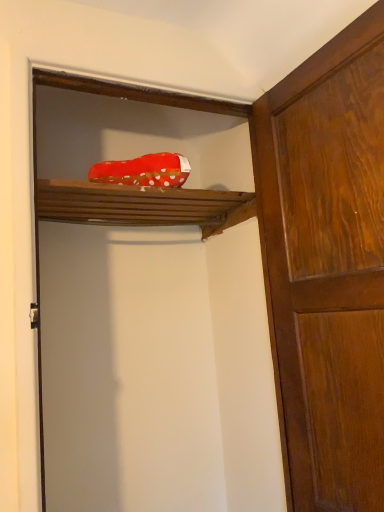
Question: Can you confirm if red polka dot fabric at center is smaller than wooden door at upper center, which appears as the 1th door when viewed from the left?

Choices:
 (A) yes
 (B) no

Answer: (A)

Question: Is red polka dot fabric at center aimed at wooden door at upper center, the 2th door from the right?

Choices:
 (A) yes
 (B) no

Answer: (A)

Question: Does red polka dot fabric at center have a larger size compared to wooden door at upper center, the 2th door from the right?

Choices:
 (A) no
 (B) yes

Answer: (A)

Question: Does red polka dot fabric at center come in front of wooden door at upper center, which appears as the 1th door when viewed from the left?

Choices:
 (A) yes
 (B) no

Answer: (B)

Question: Is red polka dot fabric at center positioned with its back to wooden door at upper center, which appears as the 1th door when viewed from the left?

Choices:
 (A) yes
 (B) no

Answer: (B)

Question: Based on their sizes in the image, would you say wooden door at right, the 2th door viewed from the left, is bigger or smaller than red polka dot fabric at center?

Choices:
 (A) small
 (B) big

Answer: (B)

Question: Based on their positions, is wooden door at right, the 2th door viewed from the left, located to the left or right of red polka dot fabric at center?

Choices:
 (A) left
 (B) right

Answer: (B)

Question: Relative to red polka dot fabric at center, is wooden door at right, the 2th door viewed from the left, in front or behind?

Choices:
 (A) front
 (B) behind

Answer: (A)

Question: In terms of height, does wooden door at right, the 2th door viewed from the left, look taller or shorter compared to red polka dot fabric at center?

Choices:
 (A) tall
 (B) short

Answer: (A)

Question: From a real-world perspective, is wooden door at upper center, which appears as the 1th door when viewed from the left, above or below red polka dot fabric at upper center?

Choices:
 (A) below
 (B) above

Answer: (A)

Question: From the image's perspective, is wooden door at upper center, the 2th door from the right, positioned above or below red polka dot fabric at upper center?

Choices:
 (A) below
 (B) above

Answer: (A)

Question: Is wooden door at upper center, which appears as the 1th door when viewed from the left, to the left or to the right of red polka dot fabric at upper center in the image?

Choices:
 (A) left
 (B) right

Answer: (B)

Question: Would you say wooden door at upper center, which appears as the 1th door when viewed from the left, is inside or outside red polka dot fabric at upper center?

Choices:
 (A) inside
 (B) outside

Answer: (B)

Question: Is wooden door at right, the 2th door viewed from the left, to the left or to the right of red polka dot fabric at upper center in the image?

Choices:
 (A) left
 (B) right

Answer: (B)

Question: In the image, is wooden door at right, positioned as the 1th door in right-to-left order, positioned in front of or behind red polka dot fabric at upper center?

Choices:
 (A) front
 (B) behind

Answer: (A)